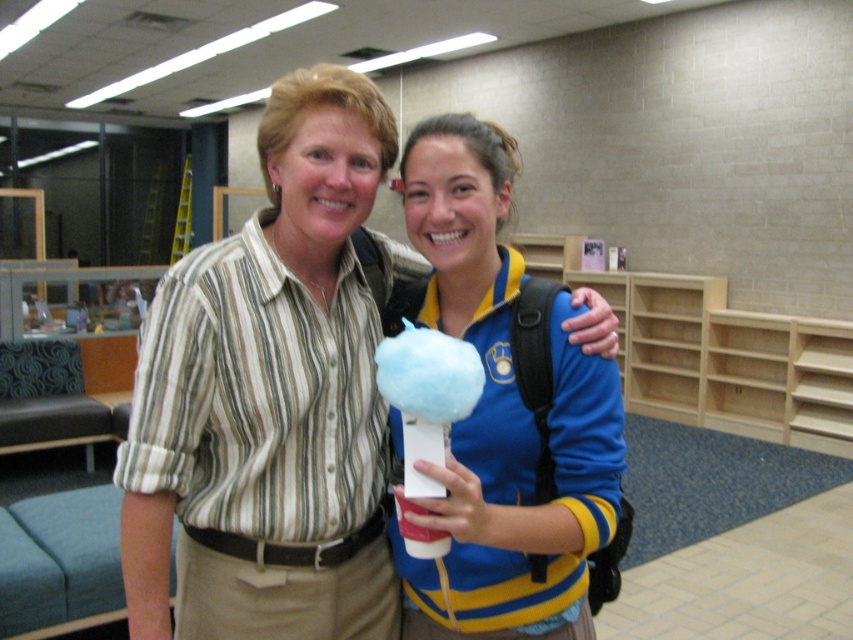
Question: Does blue cotton candy at center appear on the right side of matte blue cotton candy at center?

Choices:
 (A) no
 (B) yes

Answer: (A)

Question: Which point is closer to the camera taking this photo?

Choices:
 (A) (578, 508)
 (B) (294, 480)

Answer: (A)

Question: Can you confirm if blue cotton candy at center is positioned to the right of matte blue cotton candy at center?

Choices:
 (A) yes
 (B) no

Answer: (B)

Question: Among these objects, which one is farthest from the camera?

Choices:
 (A) matte blue cotton candy at center
 (B) blue cotton candy at center

Answer: (B)

Question: Does blue cotton candy at center appear on the right side of matte blue cotton candy at center?

Choices:
 (A) no
 (B) yes

Answer: (A)